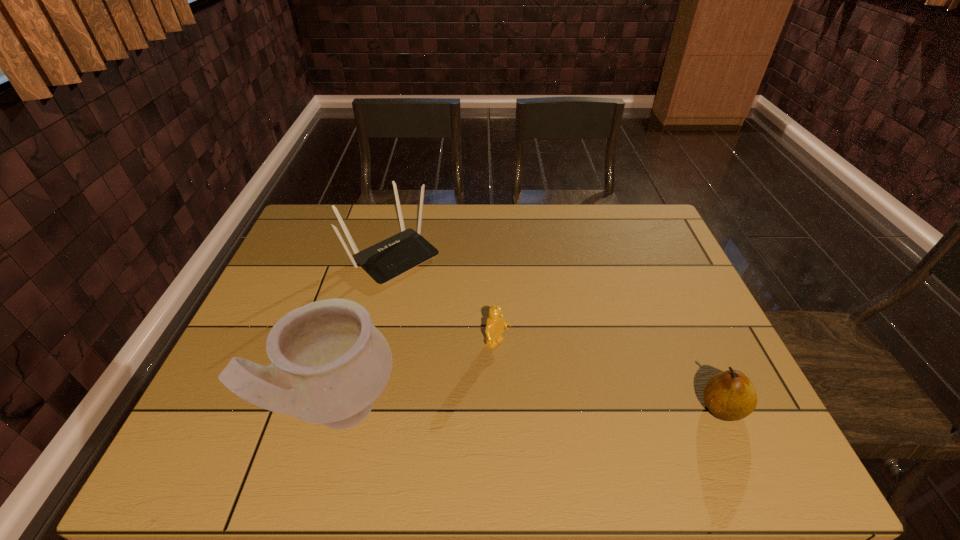
The image size is (960, 540). Find the location of `object present at the near right corner`. object present at the near right corner is located at coordinates (729, 395).

Find the location of a particular element. This screenshot has height=540, width=960. vacant region at the far edge is located at coordinates (551, 214).

Where is `vacant region at the left edge`? The height and width of the screenshot is (540, 960). vacant region at the left edge is located at coordinates (306, 296).

At what (x,y) coordinates should I click in order to perform the action: click on vacant area at the right edge. Please return your answer as a coordinate pair (x, y). This screenshot has height=540, width=960. Looking at the image, I should click on (652, 253).

This screenshot has height=540, width=960. Identify the location of free space at the far right corner of the desktop. (645, 232).

Locate an element on the screen. free spot between the pear and the router is located at coordinates [x=557, y=332].

Find the location of `free space between the tallest object and the Lego`. free space between the tallest object and the Lego is located at coordinates (419, 377).

Locate an element on the screen. The height and width of the screenshot is (540, 960). empty space between the pottery and the second object from right to left is located at coordinates (419, 377).

The width and height of the screenshot is (960, 540). Identify the location of free space between the rightmost object and the pottery. (531, 409).

Locate an element on the screen. This screenshot has height=540, width=960. free space between the Lego and the pear is located at coordinates click(611, 376).